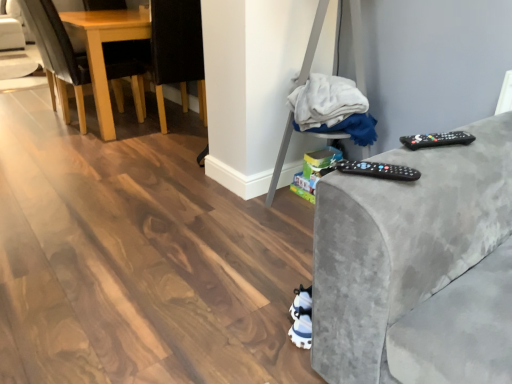
Question: In the image, is black plastic remote at right, the second remote in the left-to-right sequence, on the left side or the right side of white fabric at center?

Choices:
 (A) right
 (B) left

Answer: (A)

Question: Based on their sizes in the image, would you say black plastic remote at right, the 2th remote viewed from the front, is bigger or smaller than white fabric at center?

Choices:
 (A) small
 (B) big

Answer: (A)

Question: Which of these objects is positioned farthest from the white fabric at center?

Choices:
 (A) light brown wood chair at left, the 1th chair when ordered from left to right
 (B) black plastic remote at right, which is the first remote from back to front
 (C) black plastic remote at right, the second remote in the right-to-left sequence
 (D) black fabric chair at left, which is counted as the 2th chair, starting from the left

Answer: (A)

Question: Based on their relative distances, which object is nearer to the black fabric chair at left, which is the 1th chair in right-to-left order?

Choices:
 (A) black plastic remote at right, which is the first remote from back to front
 (B) white fabric at center
 (C) light brown wood chair at left, the second chair in the right-to-left sequence
 (D) black plastic remote at right, the second remote viewed from the top

Answer: (C)